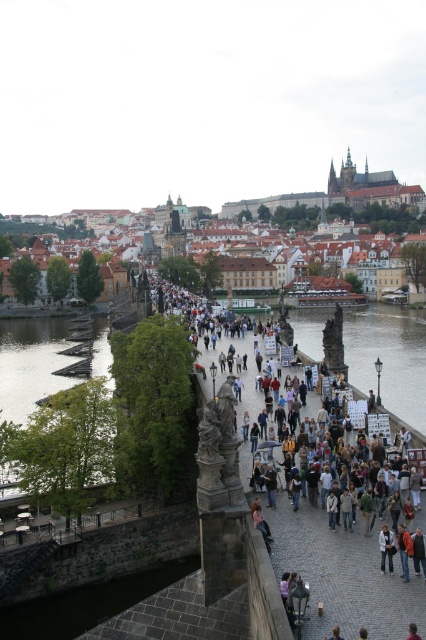
Question: Among these objects, which one is farthest from the camera?

Choices:
 (A) blonde hair at center
 (B) dark stone bridge at center
 (C) brown stone prague castle at upper center
 (D) brown leather jacket at center

Answer: (C)

Question: Is dark stone bridge at center positioned at the back of clear water at center?

Choices:
 (A) yes
 (B) no

Answer: (B)

Question: Is clear water at center positioned behind dark gray stone waterway at lower left?

Choices:
 (A) yes
 (B) no

Answer: (A)

Question: Which object is farther from the camera taking this photo?

Choices:
 (A) blonde hair at center
 (B) brown leather jacket at center

Answer: (A)

Question: Does green wood planks at left have a smaller size compared to light brown leather jacket at center?

Choices:
 (A) yes
 (B) no

Answer: (B)

Question: Which object is the farthest from the dark stone bridge at center?

Choices:
 (A) brown stone prague castle at upper center
 (B) dark gray stone waterway at lower left

Answer: (A)